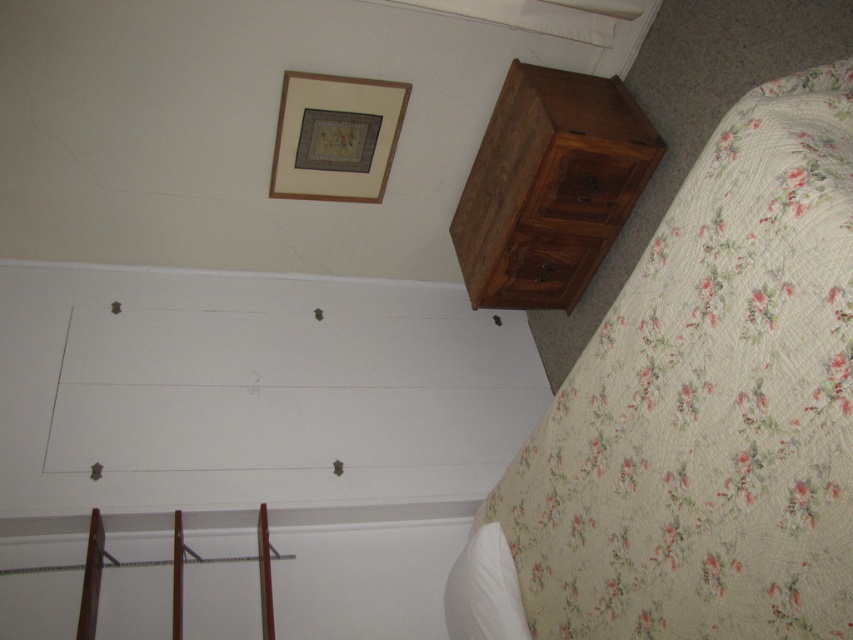
Question: Which of the following is the farthest from the observer?

Choices:
 (A) matte wood picture frame at upper center
 (B) white soft pillow at lower right

Answer: (A)

Question: Does dark brown wood drawer at upper right have a larger size compared to white soft pillow at lower right?

Choices:
 (A) yes
 (B) no

Answer: (A)

Question: Which object appears farthest from the camera in this image?

Choices:
 (A) white soft pillow at lower right
 (B) dark brown wood drawer at upper right
 (C) floral quilted bed at lower right

Answer: (B)

Question: In this image, where is matte wood picture frame at upper center located relative to wooden drawer at upper right?

Choices:
 (A) right
 (B) left

Answer: (B)

Question: Among these objects, which one is nearest to the camera?

Choices:
 (A) floral quilted bed at lower right
 (B) wooden drawer at upper right
 (C) matte wood picture frame at upper center

Answer: (A)

Question: Considering the relative positions of wooden dresser at right and white soft pillow at lower right in the image provided, where is wooden dresser at right located with respect to white soft pillow at lower right?

Choices:
 (A) left
 (B) right

Answer: (B)